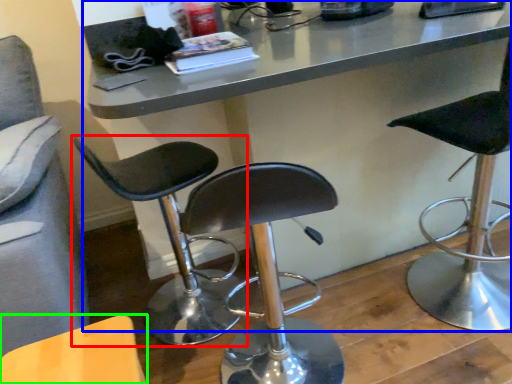
Question: Based on their relative distances, which object is nearer to chair (highlighted by a red box)? Choose from table (highlighted by a blue box) and chair (highlighted by a green box).

Choices:
 (A) table
 (B) chair

Answer: (A)